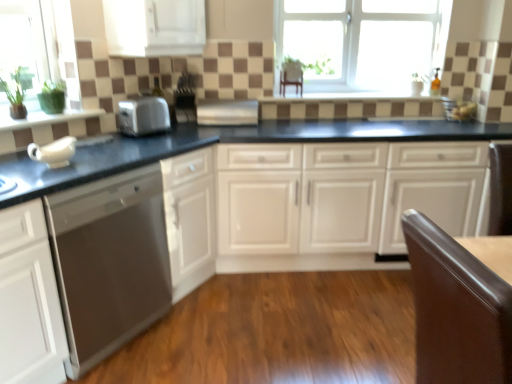
Question: Is black granite countertop at center facing towards satin silver toaster at center, placed as the 1th appliance when sorted from left to right?

Choices:
 (A) no
 (B) yes

Answer: (A)

Question: Does black granite countertop at center have a smaller size compared to satin silver toaster at center, arranged as the 2th appliance when viewed from the right?

Choices:
 (A) yes
 (B) no

Answer: (B)

Question: From the image's perspective, is black granite countertop at center above satin silver toaster at center, placed as the 1th appliance when sorted from left to right?

Choices:
 (A) no
 (B) yes

Answer: (A)

Question: Does black granite countertop at center have a lesser height compared to satin silver toaster at center, arranged as the 2th appliance when viewed from the right?

Choices:
 (A) yes
 (B) no

Answer: (B)

Question: Are black granite countertop at center and satin silver toaster at center, arranged as the 2th appliance when viewed from the right, located far from each other?

Choices:
 (A) no
 (B) yes

Answer: (A)

Question: Does black granite countertop at center appear on the right side of satin silver toaster at center, placed as the 1th appliance when sorted from left to right?

Choices:
 (A) yes
 (B) no

Answer: (A)

Question: Is satin silver toaster at center, placed as the 1th appliance when sorted from left to right, at the back of glossy brown chair at lower right?

Choices:
 (A) yes
 (B) no

Answer: (B)

Question: Is glossy brown chair at lower right with satin silver toaster at center, placed as the 1th appliance when sorted from left to right?

Choices:
 (A) no
 (B) yes

Answer: (A)

Question: Can you confirm if glossy brown chair at lower right is bigger than satin silver toaster at center, arranged as the 2th appliance when viewed from the right?

Choices:
 (A) no
 (B) yes

Answer: (B)

Question: From a real-world perspective, does glossy brown chair at lower right sit lower than satin silver toaster at center, arranged as the 2th appliance when viewed from the right?

Choices:
 (A) yes
 (B) no

Answer: (A)

Question: Is glossy brown chair at lower right outside of satin silver toaster at center, arranged as the 2th appliance when viewed from the right?

Choices:
 (A) no
 (B) yes

Answer: (B)

Question: Can you confirm if glossy brown chair at lower right is taller than satin silver toaster at center, arranged as the 2th appliance when viewed from the right?

Choices:
 (A) yes
 (B) no

Answer: (A)

Question: Is satin silver toaster at center oriented away from black granite countertop at center?

Choices:
 (A) yes
 (B) no

Answer: (B)